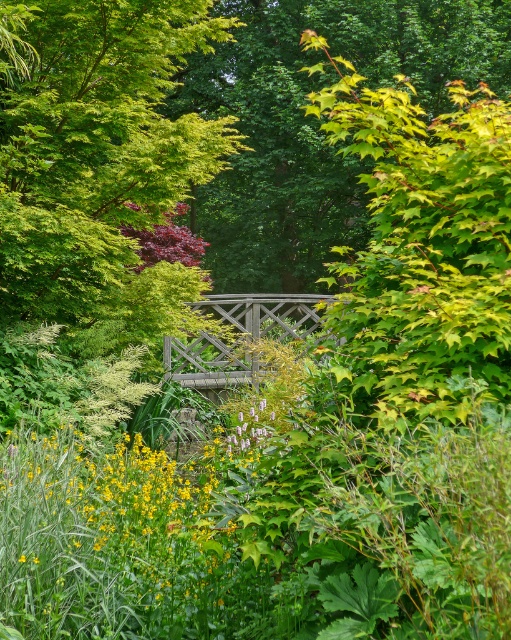
Does point (150, 218) lie behind point (207, 248)?

No, (150, 218) is in front of (207, 248).

Can you confirm if green leafy tree at upper left is positioned above green leafy tree at center?

Actually, green leafy tree at upper left is below green leafy tree at center.

Locate an element on the screen. The height and width of the screenshot is (640, 511). green leafy tree at upper left is located at coordinates (101, 164).

You are a GUI agent. You are given a task and a screenshot of the screen. Output one action in this format:
    pyautogui.click(x=<x>, y=<y>)
    Task: Click on the green leafy tree at upper left
    This screenshot has height=640, width=511.
    Given the screenshot: What is the action you would take?
    pyautogui.click(x=101, y=164)

Can you confirm if green leafy tree at center is shorter than green matte flower at center?

Incorrect, green leafy tree at center's height does not fall short of green matte flower at center's.

Who is more forward, (495, 60) or (265, 406)?

Point (265, 406) is more forward.

Who is more distant from viewer, (503, 61) or (263, 412)?

Positioned behind is point (503, 61).

The height and width of the screenshot is (640, 511). Find the location of `green leafy tree at center`. green leafy tree at center is located at coordinates (315, 122).

Can you confirm if green leafy tree at upper left is positioned below green matte flower at center?

Actually, green leafy tree at upper left is above green matte flower at center.

Consider the image. Can you confirm if green leafy tree at upper left is positioned to the right of green matte flower at center?

In fact, green leafy tree at upper left is to the left of green matte flower at center.

You are a GUI agent. You are given a task and a screenshot of the screen. Output one action in this format:
    pyautogui.click(x=<x>, y=<y>)
    Task: Click on the green leafy tree at upper left
    
    Given the screenshot: What is the action you would take?
    pyautogui.click(x=101, y=164)

Where is `green leafy tree at upper left`? green leafy tree at upper left is located at coordinates 101,164.